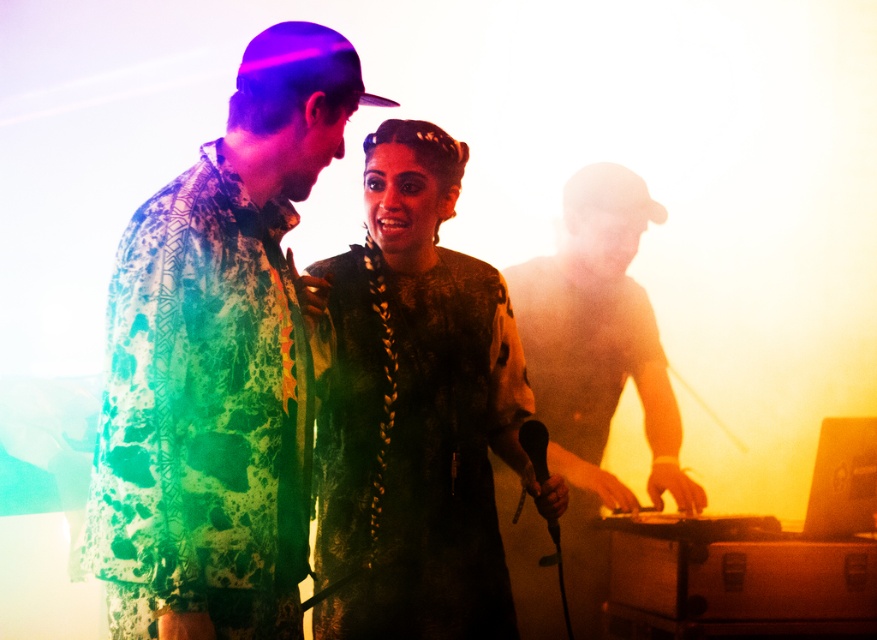
Question: Is velvet black dress at center below black matte microphone at center?

Choices:
 (A) yes
 (B) no

Answer: (B)

Question: Which point appears closest to the camera in this image?

Choices:
 (A) (524, 449)
 (B) (127, 381)
 (C) (587, 285)
 (D) (418, 214)

Answer: (B)

Question: Which of the following is the farthest from the observer?

Choices:
 (A) (572, 204)
 (B) (419, 170)
 (C) (535, 452)
 (D) (321, 42)

Answer: (A)

Question: Which object is positioned farthest from the velvet black dress at center?

Choices:
 (A) printed fabric shirt at center
 (B) shiny metallic dj deck at right

Answer: (B)

Question: Is printed fabric shirt at center smaller than velvet black dress at center?

Choices:
 (A) yes
 (B) no

Answer: (B)

Question: Is printed fabric shirt at center positioned before black matte microphone at center?

Choices:
 (A) no
 (B) yes

Answer: (B)